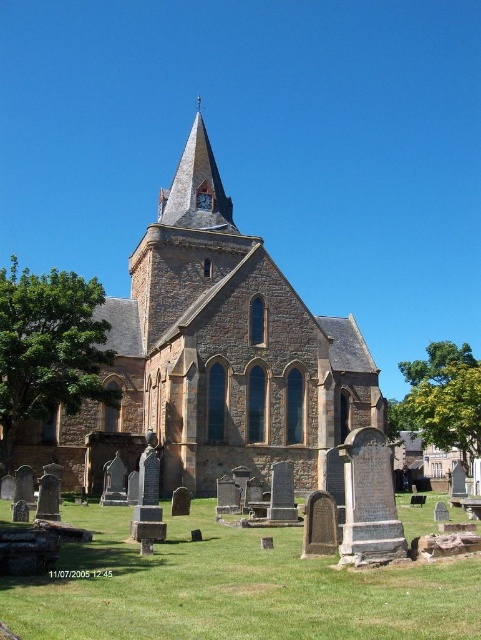
You are standing at the entrance of the graveyard and want to take a photo of the brown stone church at center. To ensure the church is centered in your photo, where should you position yourself relative to the church?

The brown stone church at center is located at point 0.555 on the x axis and 0.447 on the y axis. To center it in your photo, you should position yourself directly in front of the church, aligning your camera with its central point.

You are standing in the graveyard looking at the brown stone church at center and the smooth stone spire at upper center. Which object is located to the left of the other?

The smooth stone spire at upper center is located to the left of the brown stone church at center because the brown stone church at center is positioned on the right side of the smooth stone spire at upper center.

You are a visitor standing in front of the brown stone church at center and looking towards the smooth stone spire at upper center. Which structure appears taller from your perspective?

The smooth stone spire at upper center appears taller than the brown stone church at center because the brown stone church at center has a lesser height compared to smooth stone spire at upper center.